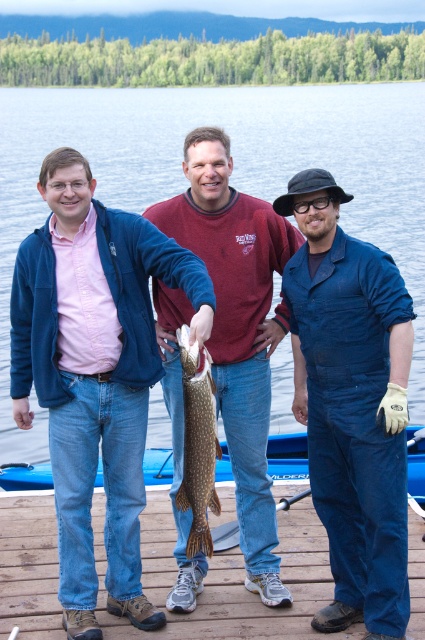
You are a photographer trying to capture a clear shot of the shiny silver fish at center and the blue plastic boat at lower center. Which object should you focus on first if you want to ensure both are in focus without moving the camera?

You should focus on the shiny silver fish at center first because it is above the blue plastic boat at lower center, so adjusting focus for the fish will also bring the boat into focus.

You are standing on the wooden dock at lower center and want to take a photo of the clear blue water at center. In which direction should you point your camera?

You should point your camera to the right of the wooden dock at lower center because the clear blue water at center is located to the right of it.

You are a photographer trying to capture the shiny silver fish at center and the blue plastic boat at lower center in the same frame. Which object should you focus on first if you want to ensure both are in focus, considering their sizes?

The shiny silver fish at center has a greater height compared to the blue plastic boat at lower center. Therefore, focus on the shiny silver fish at center first to ensure both are in focus, as it is larger and requires more attention.